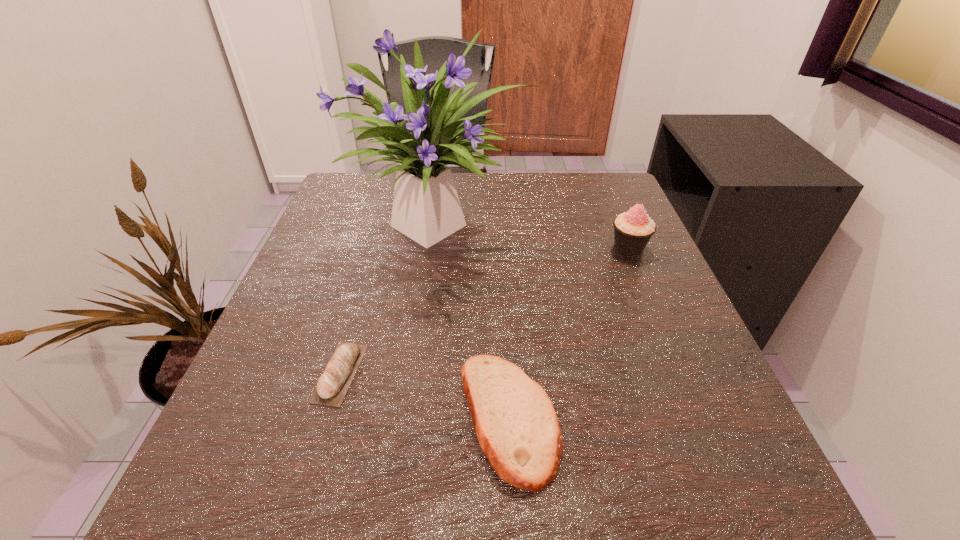
The image size is (960, 540). Find the location of `flower arrangement`. flower arrangement is located at coordinates (426, 208).

Locate an element on the screen. Image resolution: width=960 pixels, height=540 pixels. the second tallest object is located at coordinates (633, 229).

Find the location of `cupcake`. cupcake is located at coordinates (633, 229).

Identify the location of the taller pita bread. coord(518,430).

Find the location of a particular element. the right pita bread is located at coordinates (518, 430).

The image size is (960, 540). What are the coordinates of `the shortest object` in the screenshot? It's located at pyautogui.click(x=332, y=386).

Identify the location of the left pita bread. (332, 386).

At what (x,y) coordinates should I click in order to perform the action: click on free space located on the right of the tallest object. Please return your answer as a coordinate pair (x, y). This screenshot has width=960, height=540. Looking at the image, I should click on (587, 222).

Locate an element on the screen. Image resolution: width=960 pixels, height=540 pixels. blank space located on the back of the second tallest object is located at coordinates (604, 188).

The width and height of the screenshot is (960, 540). I want to click on vacant space located 0.210m on the right of the second shortest object, so click(708, 418).